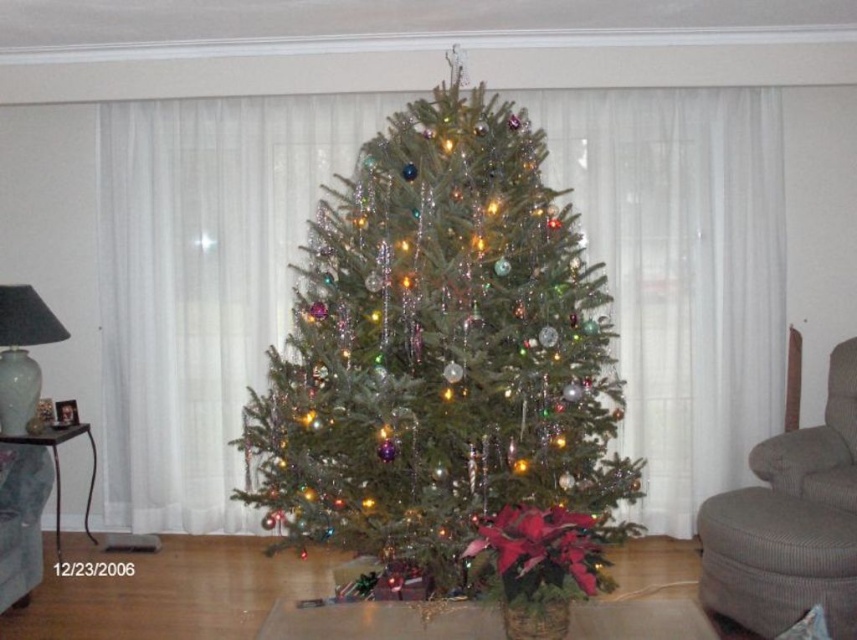
Question: Which object is farther from the camera taking this photo?

Choices:
 (A) red velvet poinsettia at lower center
 (B) green textured christmas tree at center
 (C) gray fabric armchair at right
 (D) gray fabric armchair at lower left

Answer: (D)

Question: Is gray fabric armchair at right behind red velvet poinsettia at lower center?

Choices:
 (A) no
 (B) yes

Answer: (B)

Question: Can you confirm if green textured christmas tree at center is positioned to the left of gray fabric armchair at right?

Choices:
 (A) yes
 (B) no

Answer: (A)

Question: Can you confirm if green textured christmas tree at center is thinner than gray fabric armchair at right?

Choices:
 (A) yes
 (B) no

Answer: (B)

Question: Which point is closer to the camera?

Choices:
 (A) gray fabric armchair at right
 (B) red velvet poinsettia at lower center
 (C) green textured christmas tree at center

Answer: (B)

Question: Which of these objects is positioned closest to the green textured christmas tree at center?

Choices:
 (A) red velvet poinsettia at lower center
 (B) gray fabric armchair at lower left

Answer: (A)